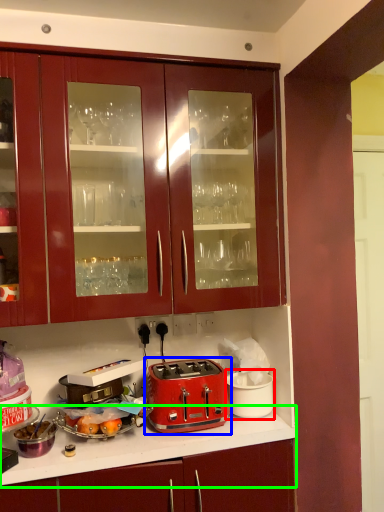
Question: Which object is the farthest from appliance (highlighted by a red box)? Choose among these: toaster (highlighted by a blue box) or countertop (highlighted by a green box).

Choices:
 (A) toaster
 (B) countertop

Answer: (B)